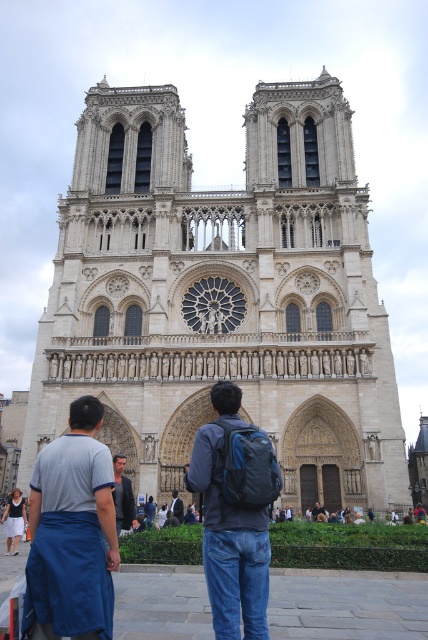
Who is taller, white stone cathedral at center or matte blue backpack at center?

white stone cathedral at center

Does white stone cathedral at center lie behind matte blue backpack at center?

Yes, white stone cathedral at center is further from the viewer.

Is point (149, 115) positioned in front of point (250, 506)?

No, it is not.

Locate an element on the screen. white stone cathedral at center is located at coordinates (222, 296).

Can you confirm if blue fabric apron at lower left is positioned above matte blue backpack at center?

Actually, blue fabric apron at lower left is below matte blue backpack at center.

Does point (56, 464) come in front of point (258, 456)?

Yes, point (56, 464) is in front of point (258, 456).

The height and width of the screenshot is (640, 428). Find the location of `blue fabric apron at lower left`. blue fabric apron at lower left is located at coordinates (71, 532).

Does white stone cathedral at center appear on the right side of blue fabric apron at lower left?

Indeed, white stone cathedral at center is positioned on the right side of blue fabric apron at lower left.

Is point (359, 426) positioned after point (103, 608)?

Yes, it is.

Identify the location of white stone cathedral at center. The image size is (428, 640). (222, 296).